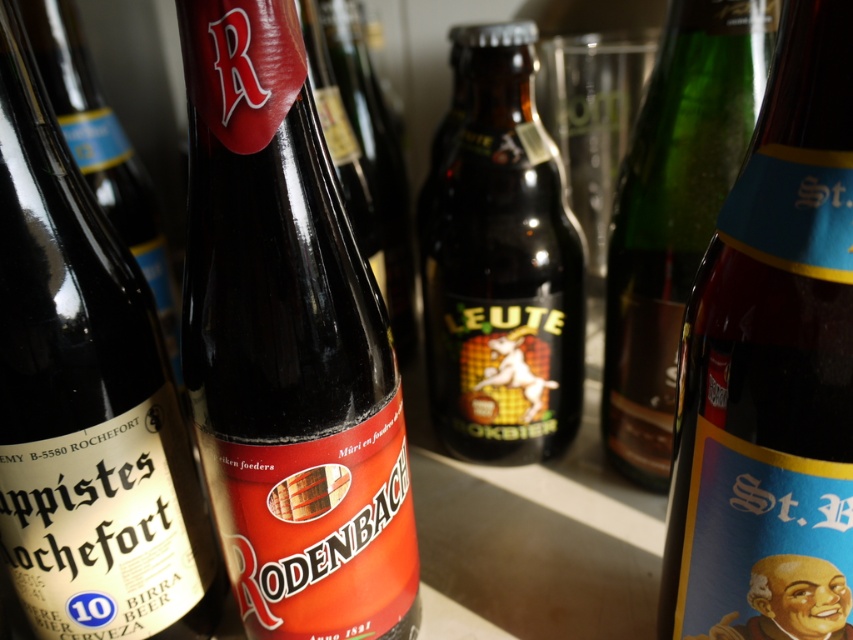
Question: Estimate the real-world distances between objects in this image. Which object is farther from the dark brown glass bottle at center?

Choices:
 (A) shiny dark glass bottle at center
 (B) matte black bottle at left
 (C) matte black bottle at center

Answer: (C)

Question: Is matte black bottle at center to the left of dark brown glass bottle at center from the viewer's perspective?

Choices:
 (A) no
 (B) yes

Answer: (B)

Question: Which of the following is the farthest from the observer?

Choices:
 (A) [808, 307]
 (B) [614, 289]
 (C) [64, 112]
 (D) [125, 298]

Answer: (C)

Question: Which object is closer to the camera taking this photo?

Choices:
 (A) matte black bottle at left
 (B) dark brown glass bottle at center
 (C) shiny dark glass bottle at center
 (D) matte brown bottle at center

Answer: (D)

Question: Does matte black bottle at center appear on the right side of dark brown glass bottle at center?

Choices:
 (A) yes
 (B) no

Answer: (B)

Question: Does shiny dark glass bottle at center appear on the right side of green glass bottle at center?

Choices:
 (A) yes
 (B) no

Answer: (B)